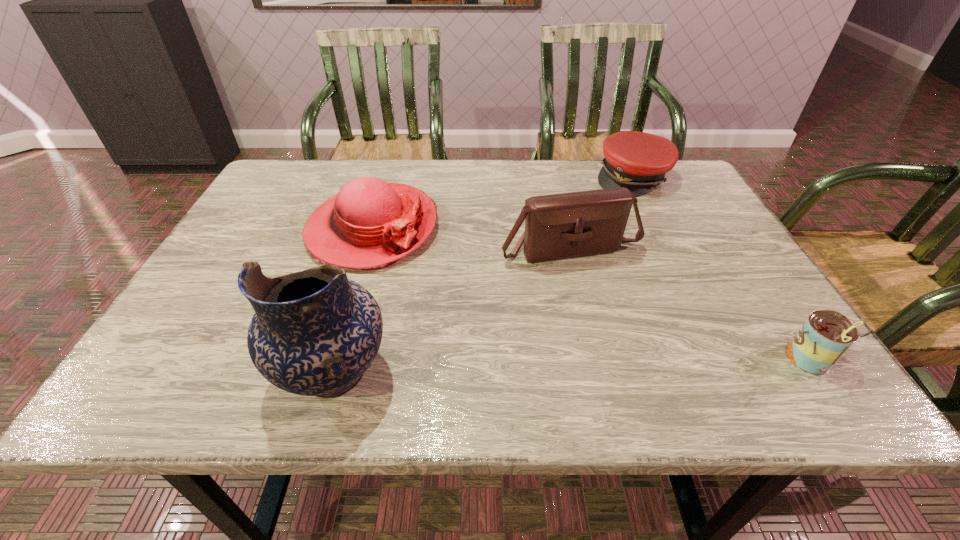
Where is `free space that satisfies the following two spatial constraints: 1. on the front side of the hat; 2. on the left side of the can`? free space that satisfies the following two spatial constraints: 1. on the front side of the hat; 2. on the left side of the can is located at coordinates (333, 359).